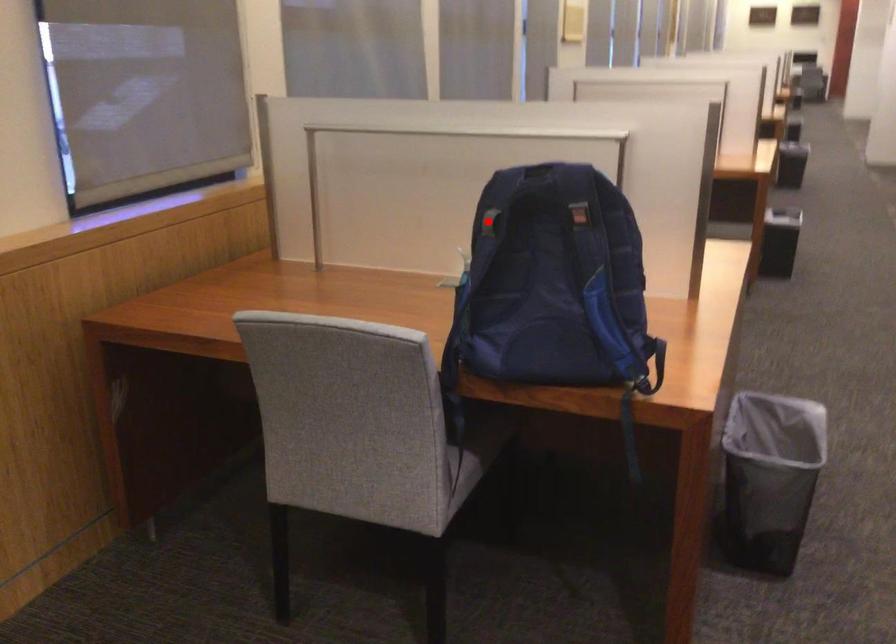
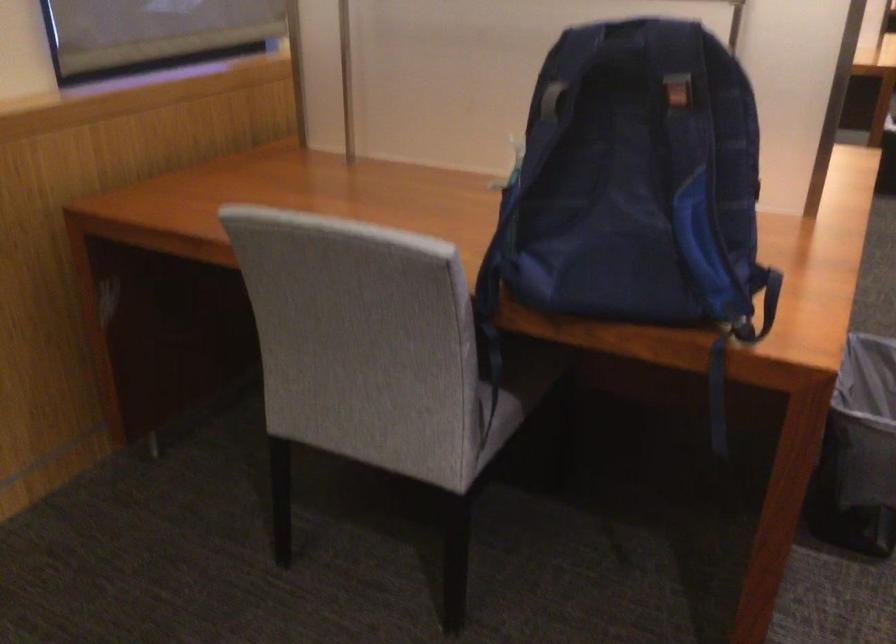
Question: A red point is marked in image1. In image2, is the corresponding 3D point closer to the camera or farther? Reply with the corresponding letter.

Choices:
 (A) The corresponding 3D point is closer.
 (B) The corresponding 3D point is farther.

Answer: (A)